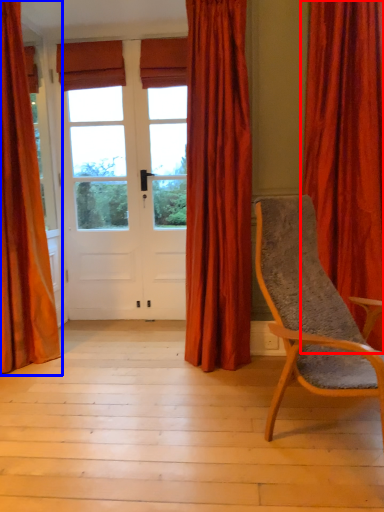
Question: Which of the following is the closest to the observer, curtain (highlighted by a red box) or curtain (highlighted by a blue box)?

Choices:
 (A) curtain
 (B) curtain

Answer: (A)